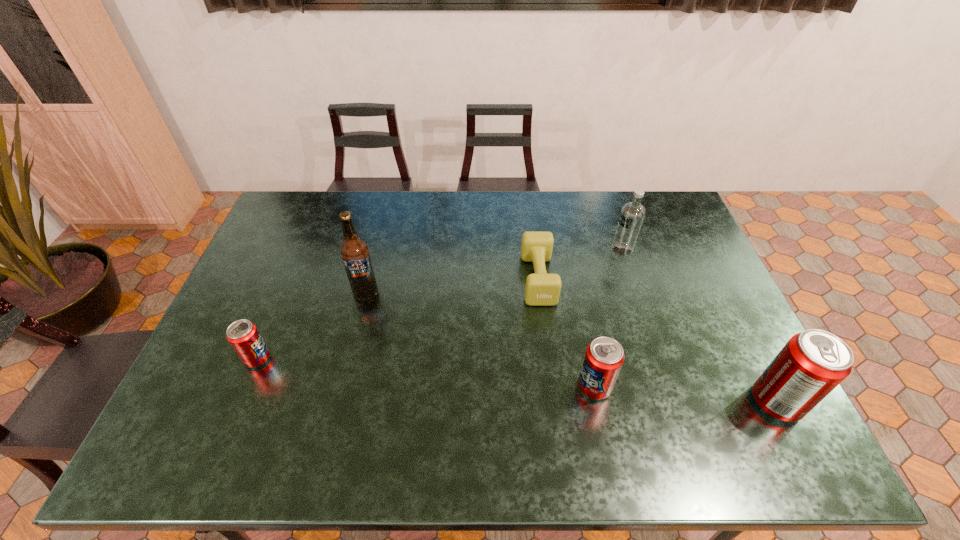
The image size is (960, 540). In order to click on object that is the second closest to the fourth tallest object in this screenshot , I will do `click(814, 362)`.

Locate which soda can is the second closest to the second object from right to left. Please provide its 2D coordinates. Your answer should be formatted as a tuple, i.e. [(x, y)], where the tuple contains the x and y coordinates of a point satisfying the conditions above.

[(814, 362)]

Choose which soda can is the third nearest neighbor to the second object from right to left. Please provide its 2D coordinates. Your answer should be formatted as a tuple, i.e. [(x, y)], where the tuple contains the x and y coordinates of a point satisfying the conditions above.

[(244, 337)]

Locate an element on the screen. free location that satisfies the following two spatial constraints: 1. on the front side of the second tallest soda can; 2. on the left side of the dumbbell is located at coordinates (552, 387).

At what (x,y) coordinates should I click in order to perform the action: click on blank space that satisfies the following two spatial constraints: 1. on the label of the fifth object from right to left; 2. on the right side of the fourth object from left to right. Please return your answer as a coordinate pair (x, y). The width and height of the screenshot is (960, 540). Looking at the image, I should click on (342, 387).

Where is `vacant position in the image that satisfies the following two spatial constraints: 1. on the front label of the second object from right to left; 2. on the label of the fifth object from right to left`? The image size is (960, 540). vacant position in the image that satisfies the following two spatial constraints: 1. on the front label of the second object from right to left; 2. on the label of the fifth object from right to left is located at coordinates (636, 289).